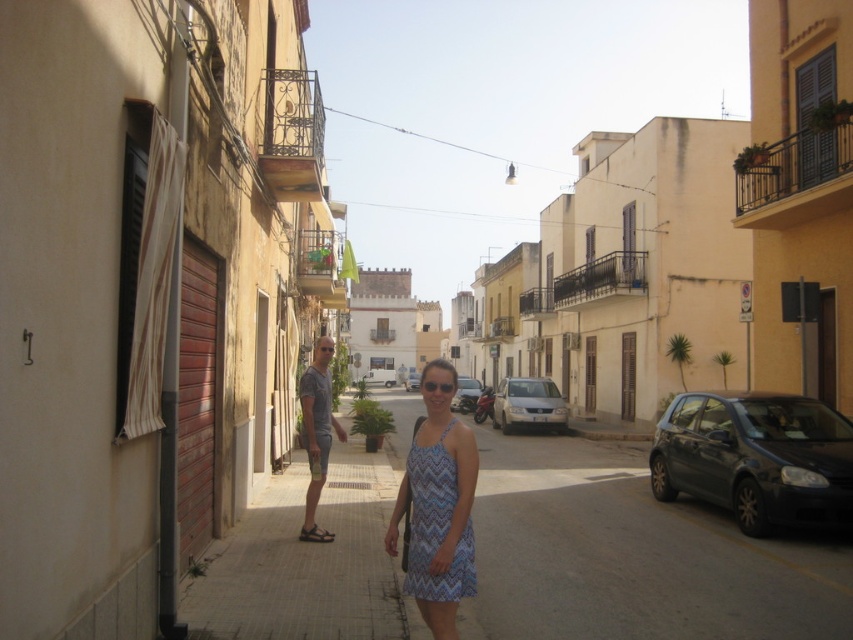
You are a delivery person standing at the edge of the yellow line on the street. You need to place a package on the blue zigzag dress at center and then deliver another item to the brown leather sandal at lower center. Considering the distance between them, can you reach both locations without moving more than 4 feet from your starting position?

The blue zigzag dress at center is 3.85 feet from the brown leather sandal at lower center. Since the total distance between them is less than 4 feet, you can reach both locations without moving more than 4 feet from your starting position.